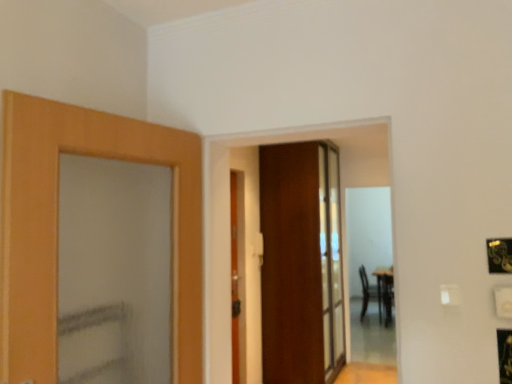
Question: Can you confirm if wooden door at center, which ranks as the first door in back-to-front order, is shorter than black leather armchair at right?

Choices:
 (A) yes
 (B) no

Answer: (B)

Question: Does wooden door at center, the 1th door when ordered from right to left, touch black leather armchair at right?

Choices:
 (A) no
 (B) yes

Answer: (A)

Question: From a real-world perspective, is wooden door at center, the 1th door when ordered from right to left, positioned over black leather armchair at right based on gravity?

Choices:
 (A) no
 (B) yes

Answer: (B)

Question: From the image's perspective, is wooden door at center, the 1th door when ordered from right to left, on black leather armchair at right?

Choices:
 (A) yes
 (B) no

Answer: (A)

Question: Would you say wooden door at center, which ranks as the first door in back-to-front order, contains black leather armchair at right?

Choices:
 (A) yes
 (B) no

Answer: (B)

Question: From their relative heights in the image, would you say wooden door at center, acting as the 2th door starting from the right, is taller or shorter than wooden door at center, acting as the 2th door starting from the front?

Choices:
 (A) tall
 (B) short

Answer: (B)

Question: Is wooden door at center, acting as the 1th door starting from the front, wider or thinner than wooden door at center, which ranks as the first door in back-to-front order?

Choices:
 (A) thin
 (B) wide

Answer: (A)

Question: Is wooden door at center, which ranks as the first door in left-to-right order, in front of or behind wooden door at center, the 1th door when ordered from right to left, in the image?

Choices:
 (A) front
 (B) behind

Answer: (A)

Question: From a real-world perspective, is wooden door at center, acting as the 2th door starting from the right, positioned above or below wooden door at center, the 1th door when ordered from right to left?

Choices:
 (A) above
 (B) below

Answer: (B)

Question: Based on their sizes in the image, would you say black leather armchair at right is bigger or smaller than wooden door at center, the 1th door when ordered from right to left?

Choices:
 (A) big
 (B) small

Answer: (B)

Question: Do you think black leather armchair at right is within wooden door at center, the 1th door when ordered from right to left, or outside of it?

Choices:
 (A) inside
 (B) outside

Answer: (B)

Question: Considering the positions of black leather armchair at right and wooden door at center, the 1th door when ordered from right to left, in the image, is black leather armchair at right wider or thinner than wooden door at center, the 1th door when ordered from right to left,?

Choices:
 (A) thin
 (B) wide

Answer: (A)

Question: From the image's perspective, is black leather armchair at right above or below wooden door at center, which ranks as the first door in back-to-front order?

Choices:
 (A) above
 (B) below

Answer: (B)

Question: Is wooden door at center, acting as the 2th door starting from the front, inside or outside of wooden door at center, which ranks as the first door in left-to-right order?

Choices:
 (A) outside
 (B) inside

Answer: (A)

Question: Does point (288, 165) appear closer or farther from the camera than point (237, 281)?

Choices:
 (A) closer
 (B) farther

Answer: (B)